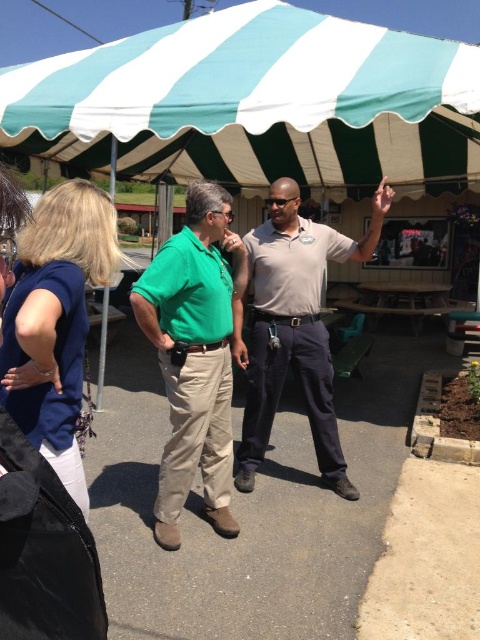
You are standing at the picnic area under the striped awning. There is a point marked at coordinates (x=255, y=100). Can you tell me what color the point is on?

The point at (x=255, y=100) is on the teal and white striped canopy at upper center, so the color at that point would be either teal or white depending on the stripe it lands on.

You are standing at the center of the picnic area under the striped awning. You want to find the green cotton shirt at center. Which direction should you look to locate it?

The green cotton shirt at center is located at point 0.558 on the x axis and 0.406 on the y axis, so you should look towards the center of the picnic area to find it.